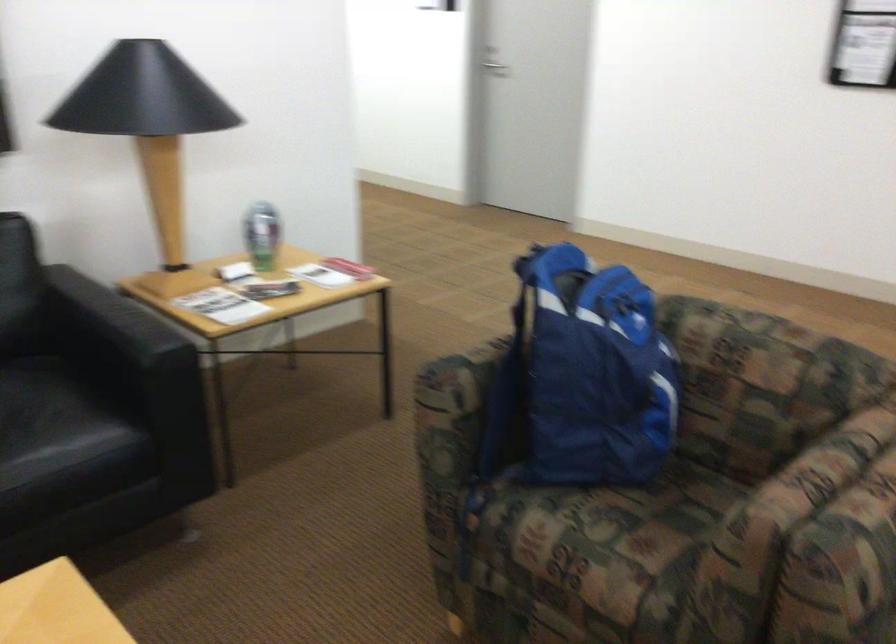
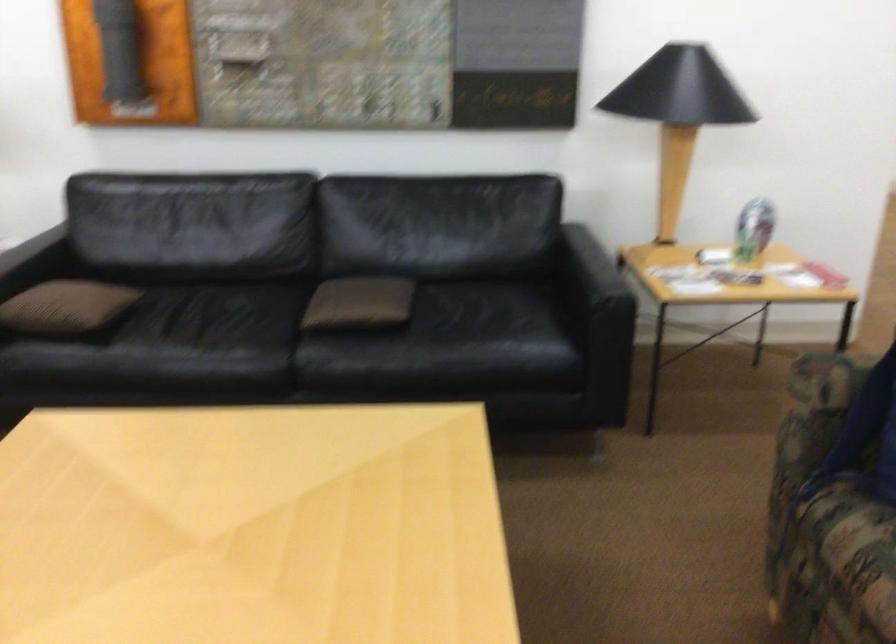
Locate, in the second image, the point that corresponds to [151,368] in the first image.

(599, 306)